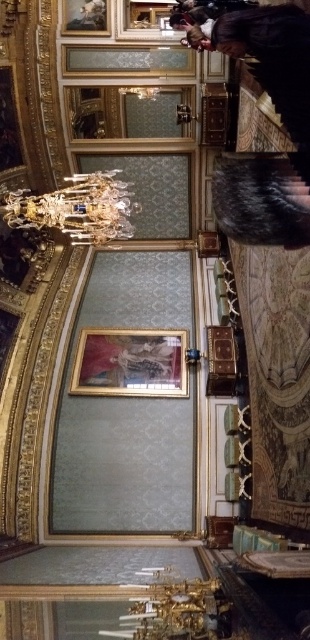
You are standing in the center of the room and want to look up at the crystal glass chandelier at upper center. Based on its coordinates, is it directly above you or offset to one side?

The crystal glass chandelier at upper center is located at point coordinates, which means it is positioned to the left and slightly above your current position in the room.

You are a photographer standing in the room and want to capture a closeup shot of the crystal glass chandelier at upper center. Given that your camera has a maximum focus range of 100 feet, will you be able to focus on the chandelier from your current position?

The crystal glass chandelier at upper center is 139.79 feet from camera, which exceeds the camera maximum focus range of 100 feet. Therefore, you cannot focus on the chandelier from your current position.